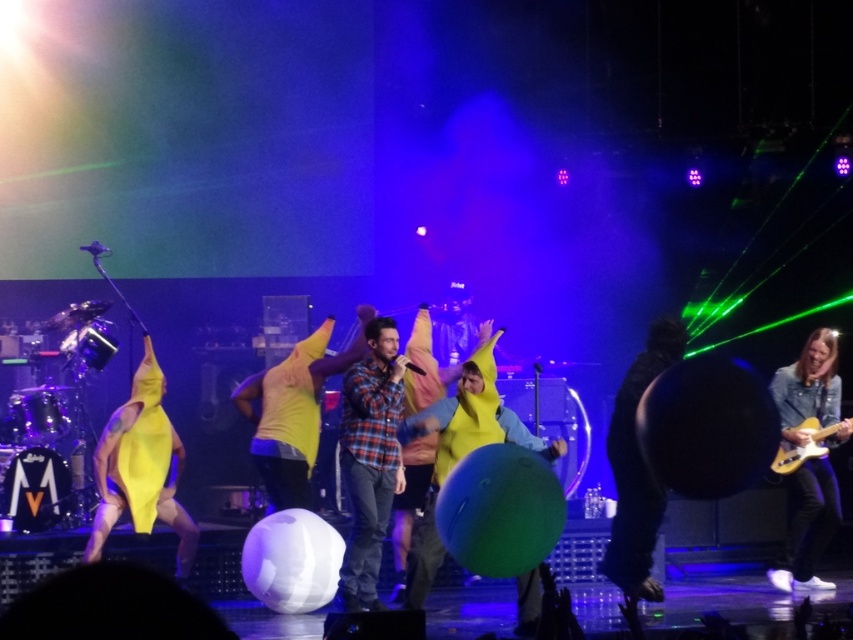
Question: Considering the relative positions of yellow rubber banana at center and black fuzzy jacket at center in the image provided, where is yellow rubber banana at center located with respect to black fuzzy jacket at center?

Choices:
 (A) left
 (B) right

Answer: (A)

Question: Is the position of plaid flannel shirt at center less distant than that of black fuzzy jacket at center?

Choices:
 (A) no
 (B) yes

Answer: (A)

Question: Can you confirm if yellow rubber banana at center is wider than yellow matte banana at center?

Choices:
 (A) yes
 (B) no

Answer: (A)

Question: Which object is farther from the camera taking this photo?

Choices:
 (A) denim jacket at lower right
 (B) yellow fabric banana at left

Answer: (A)

Question: Which object is farther from the camera taking this photo?

Choices:
 (A) yellow fabric banana at left
 (B) yellow matte banana at center
 (C) black fuzzy jacket at center
 (D) denim jacket at lower right

Answer: (D)

Question: Considering the real-world distances, which object is farthest from the plaid flannel shirt at center?

Choices:
 (A) yellow fabric banana at left
 (B) denim jacket at lower right
 (C) yellow rubber banana at center
 (D) yellow matte banana at center

Answer: (B)